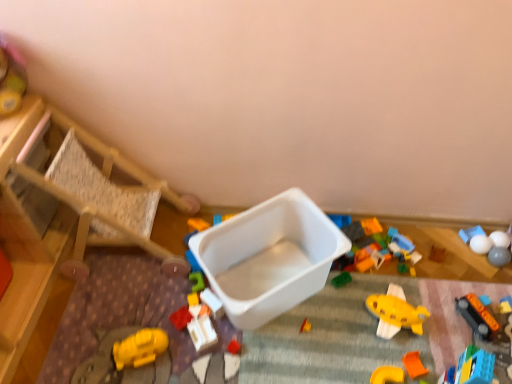
Locate an element on the screen. free location in front of smooth gray ball at lower right, which appears as the 2th toy when viewed from the right is located at coordinates (496, 303).